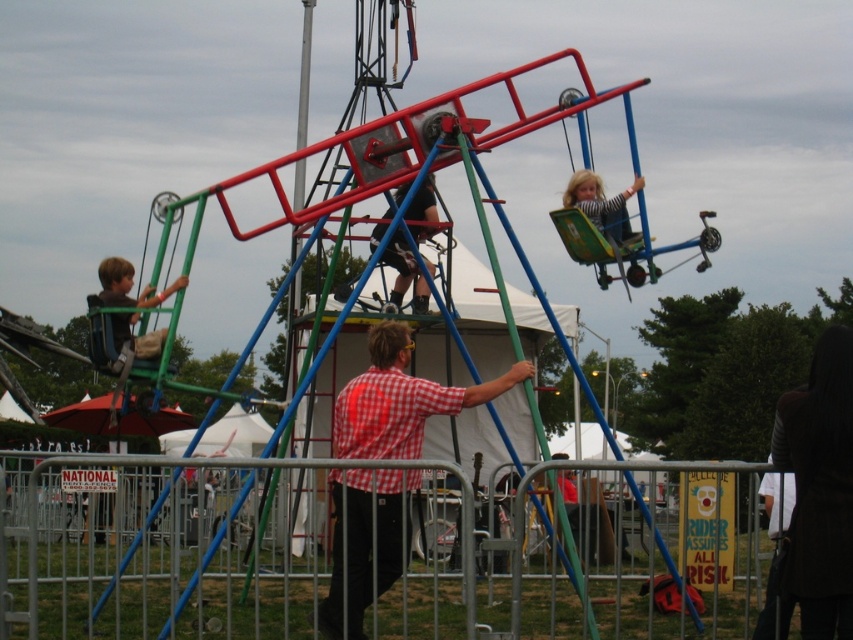
Question: Does dark brown leather jacket at lower right have a smaller size compared to matte black pants at center?

Choices:
 (A) yes
 (B) no

Answer: (B)

Question: Estimate the real-world distances between objects in this image. Which object is closer to the matte black pants at center?

Choices:
 (A) striped fabric child at upper center
 (B) dark brown leather jacket at lower right
 (C) red checkered shirt at center

Answer: (C)

Question: Which object appears closest to the camera in this image?

Choices:
 (A) matte green swing at left
 (B) dark brown leather jacket at lower right
 (C) red checkered shirt at center

Answer: (B)

Question: Can you confirm if dark brown leather jacket at lower right is thinner than matte black pants at center?

Choices:
 (A) yes
 (B) no

Answer: (B)

Question: Estimate the real-world distances between objects in this image. Which object is farther from the matte black pants at center?

Choices:
 (A) matte green swing at left
 (B) striped fabric child at upper center

Answer: (A)

Question: Does red checkered shirt at center have a lesser width compared to matte green swing at left?

Choices:
 (A) yes
 (B) no

Answer: (B)